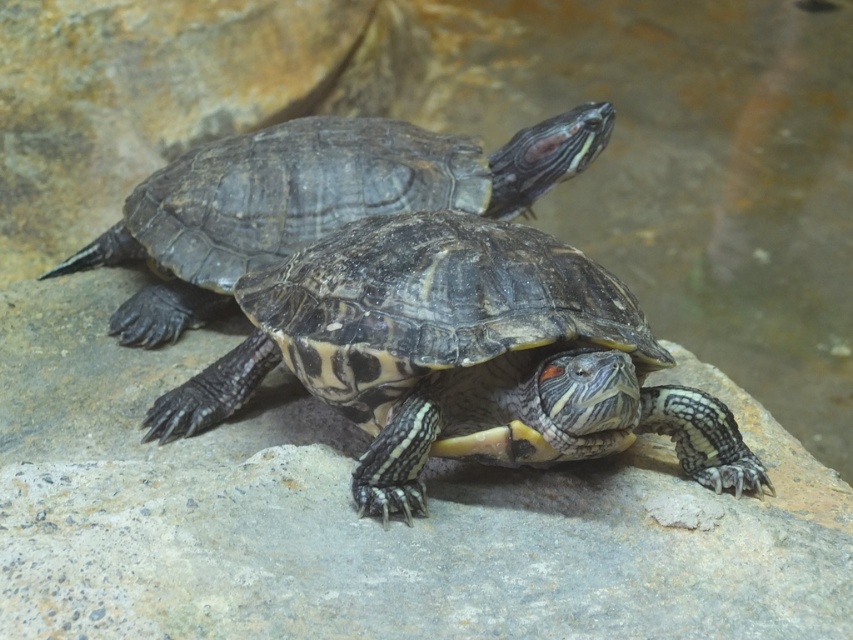
Between patterned shell turtle at center and shiny dark tortoise at center, which one appears on the right side from the viewer's perspective?

From the viewer's perspective, patterned shell turtle at center appears more on the right side.

Does patterned shell turtle at center have a lesser width compared to shiny dark tortoise at center?

Indeed, patterned shell turtle at center has a lesser width compared to shiny dark tortoise at center.

Which is behind, point (384, 502) or point (390, 138)?

Positioned behind is point (390, 138).

Where is `patterned shell turtle at center`? patterned shell turtle at center is located at coordinates (459, 355).